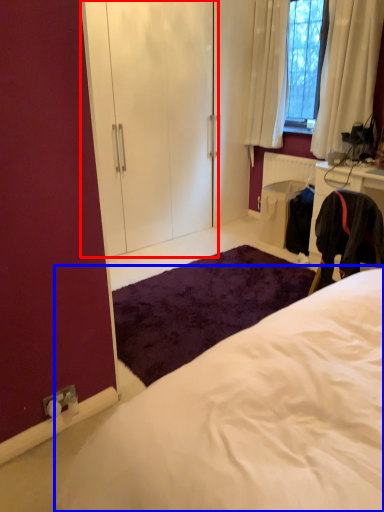
Question: Which of the following is the farthest to the observer, armoire (highlighted by a red box) or bed (highlighted by a blue box)?

Choices:
 (A) armoire
 (B) bed

Answer: (A)